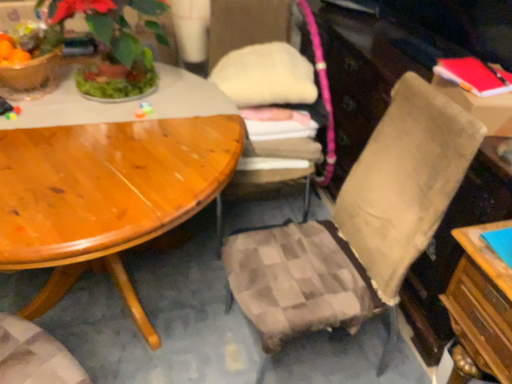
Question: Is plaid fabric chair at center, the 2th chair from the right, completely or partially inside matte plastic flowerpot at upper left?

Choices:
 (A) no
 (B) yes

Answer: (A)

Question: Is matte plastic flowerpot at upper left directly adjacent to plaid fabric chair at center, the 2th chair from the right?

Choices:
 (A) yes
 (B) no

Answer: (B)

Question: Is matte plastic flowerpot at upper left smaller than plaid fabric chair at center, which ranks as the first chair in left-to-right order?

Choices:
 (A) yes
 (B) no

Answer: (A)

Question: Is matte plastic flowerpot at upper left outside of plaid fabric chair at center, the 2th chair from the right?

Choices:
 (A) no
 (B) yes

Answer: (B)

Question: Can you confirm if matte plastic flowerpot at upper left is bigger than plaid fabric chair at center, the 2th chair from the right?

Choices:
 (A) yes
 (B) no

Answer: (B)

Question: Is beige fabric chair at center, acting as the second chair starting from the left, inside or outside of plaid fabric chair at center, the 2th chair from the right?

Choices:
 (A) outside
 (B) inside

Answer: (A)

Question: Looking at the image, does beige fabric chair at center, acting as the second chair starting from the left, seem bigger or smaller compared to plaid fabric chair at center, the 2th chair from the right?

Choices:
 (A) big
 (B) small

Answer: (A)

Question: Looking at their shapes, would you say beige fabric chair at center, acting as the second chair starting from the left, is wider or thinner than plaid fabric chair at center, which ranks as the first chair in left-to-right order?

Choices:
 (A) wide
 (B) thin

Answer: (B)

Question: Is point (288, 327) closer or farther from the camera than point (224, 23)?

Choices:
 (A) closer
 (B) farther

Answer: (A)

Question: Looking at the image, does red matte book at upper right seem bigger or smaller compared to plaid fabric chair at center, which ranks as the first chair in left-to-right order?

Choices:
 (A) big
 (B) small

Answer: (B)

Question: Considering the positions of red matte book at upper right and plaid fabric chair at center, the 2th chair from the right, in the image, is red matte book at upper right wider or thinner than plaid fabric chair at center, the 2th chair from the right,?

Choices:
 (A) thin
 (B) wide

Answer: (A)

Question: Is red matte book at upper right inside or outside of plaid fabric chair at center, the 2th chair from the right?

Choices:
 (A) inside
 (B) outside

Answer: (B)

Question: From a real-world perspective, is red matte book at upper right physically located above or below plaid fabric chair at center, which ranks as the first chair in left-to-right order?

Choices:
 (A) below
 (B) above

Answer: (B)

Question: In terms of height, does red matte book at upper right look taller or shorter compared to green leafy plant at upper left?

Choices:
 (A) tall
 (B) short

Answer: (B)

Question: Considering their positions, is red matte book at upper right located in front of or behind green leafy plant at upper left?

Choices:
 (A) front
 (B) behind

Answer: (B)